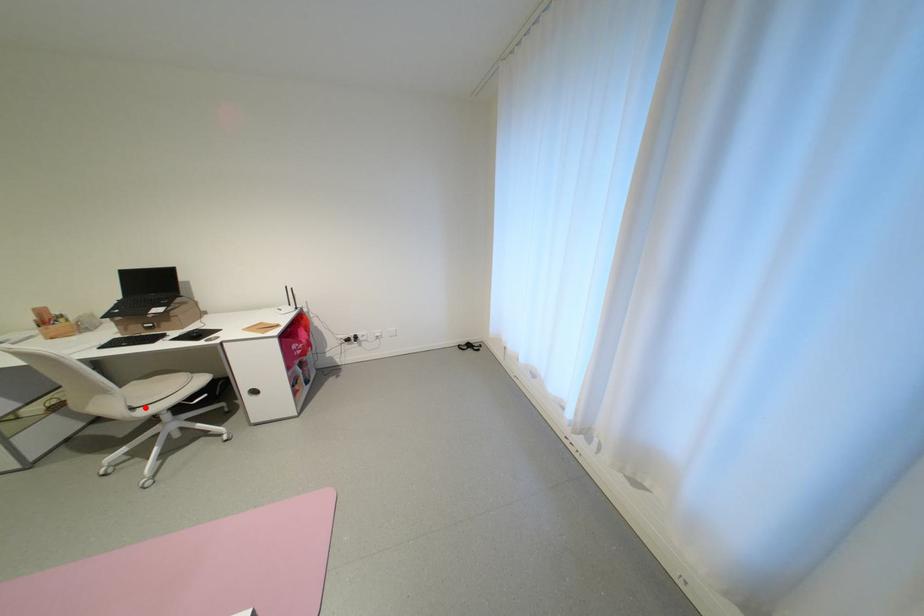
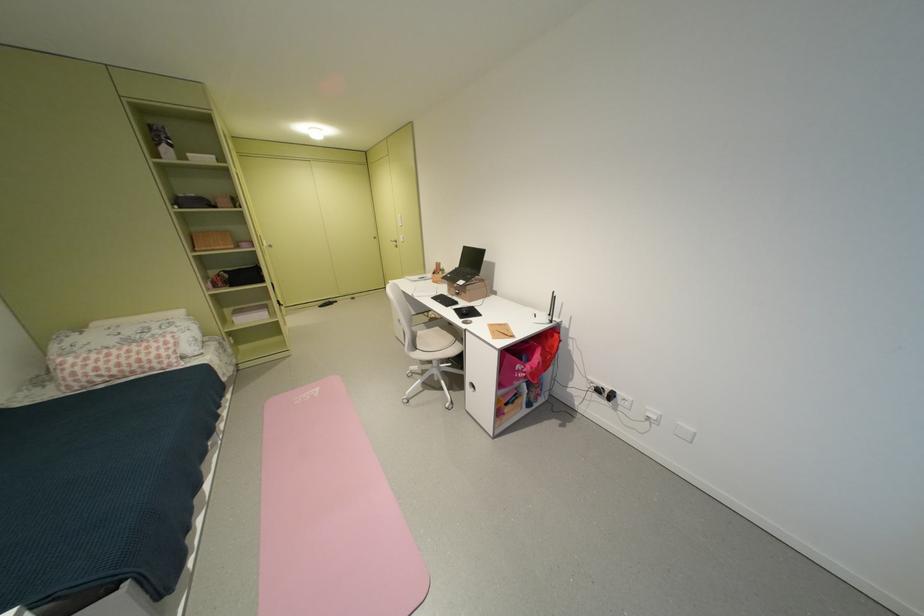
Locate, in the second image, the point that corresponds to the highlighted location in the first image.

(428, 349)